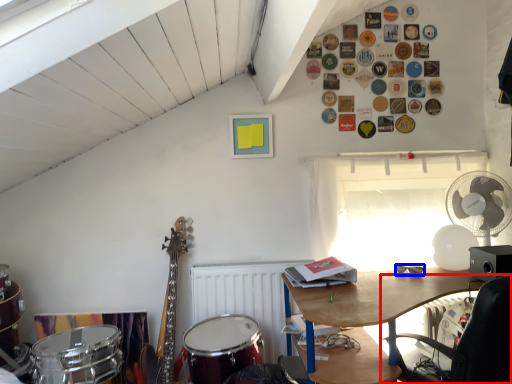
Question: Which of the following is the closest to the observer, chair (highlighted by a red box) or glasses (highlighted by a blue box)?

Choices:
 (A) chair
 (B) glasses

Answer: (A)